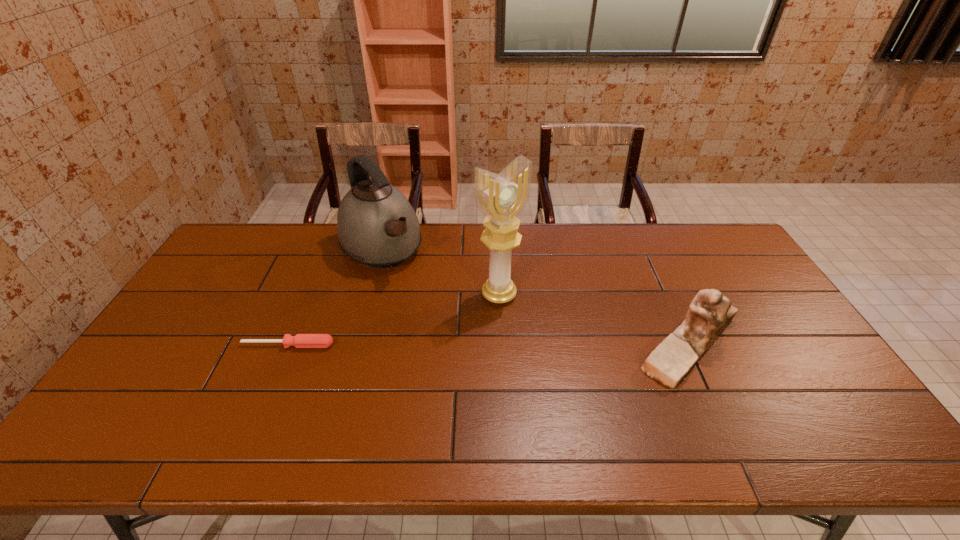
Locate an element on the screen. The width and height of the screenshot is (960, 540). free space located 0.100m on the front-facing side of the figurine is located at coordinates (596, 345).

What are the coordinates of `vacant area situated 0.100m at the spout of the second tallest object` in the screenshot? It's located at (415, 293).

Find the location of `free location located 0.220m at the spout of the second tallest object`. free location located 0.220m at the spout of the second tallest object is located at coordinates (434, 315).

Locate an element on the screen. The height and width of the screenshot is (540, 960). vacant space positioned 0.060m at the spout of the second tallest object is located at coordinates (408, 286).

I want to click on free space located on the front-facing side of the award, so click(x=586, y=384).

This screenshot has height=540, width=960. Identify the location of free space located on the front-facing side of the award. (586, 384).

The width and height of the screenshot is (960, 540). Identify the location of free space located 0.270m on the front-facing side of the award. (570, 368).

The width and height of the screenshot is (960, 540). What are the coordinates of `object positioned at the far edge` in the screenshot? It's located at (376, 225).

Identify the location of object at the near edge. (710, 312).

In the image, there is a desktop. Where is `vacant space at the far edge`? This screenshot has width=960, height=540. vacant space at the far edge is located at coordinates (513, 256).